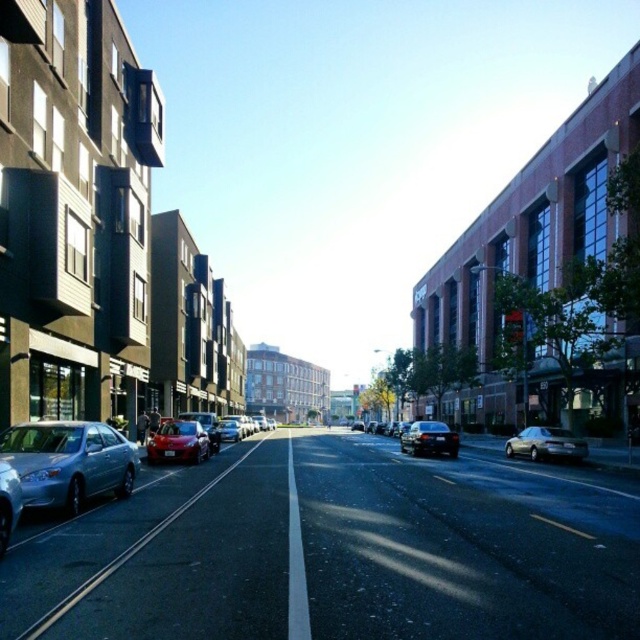
You are a delivery person who needs to park your vehicle between the satin silver sedan at left and the shiny red sedan at center. Given that your delivery van is 5 meters long, can you safely park your van in this space without overlapping either vehicle?

The satin silver sedan at left is closer to the viewer than the shiny red sedan at center, so the distance between them may not be sufficient for a 5 meter long van. You should check the space carefully before attempting to park.

You are a delivery driver who needs to park your truck between the satin silver sedan at left and the shiny red sedan at center. Is there enough space between them for your truck which is 6 meters long?

The satin silver sedan at left is positioned over shiny red sedan at center, meaning they are parked in a way that there is no space between them. Therefore, there is insufficient space for the truck to park between them.

You are standing at the center of the city street scene. There is a point marked at coordinates (68, 461). Based on the scene description, can you determine which object this point is located on?

The point at coordinates (68, 461) is located on the satin silver sedan at left.